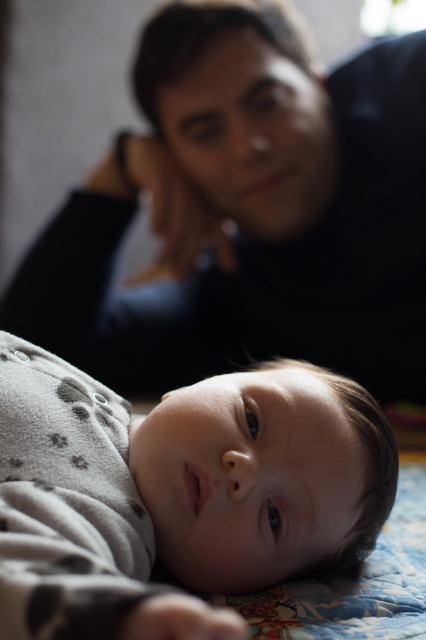
Question: Among these points, which one is farthest from the camera?

Choices:
 (A) (184, 554)
 (B) (95, 368)

Answer: (B)

Question: Among these objects, which one is nearest to the camera?

Choices:
 (A) gray dotted fabric at lower center
 (B) black matte shirt at upper center

Answer: (A)

Question: Can you confirm if black matte shirt at upper center is bigger than gray dotted fabric at lower center?

Choices:
 (A) no
 (B) yes

Answer: (B)

Question: Which of the following is the farthest from the observer?

Choices:
 (A) black matte shirt at upper center
 (B) gray dotted fabric at lower center

Answer: (A)

Question: Is the position of black matte shirt at upper center less distant than that of gray dotted fabric at lower center?

Choices:
 (A) yes
 (B) no

Answer: (B)

Question: Is black matte shirt at upper center positioned before gray dotted fabric at lower center?

Choices:
 (A) yes
 (B) no

Answer: (B)